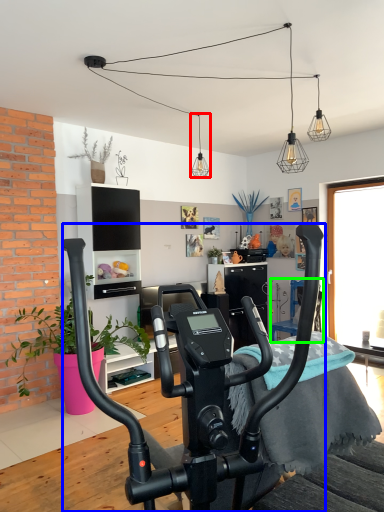
Question: Considering the real-world distances, which object is farthest from light fixture (highlighted by a red box)? stationary bicycle (highlighted by a blue box) or armchair (highlighted by a green box)?

Choices:
 (A) stationary bicycle
 (B) armchair

Answer: (A)